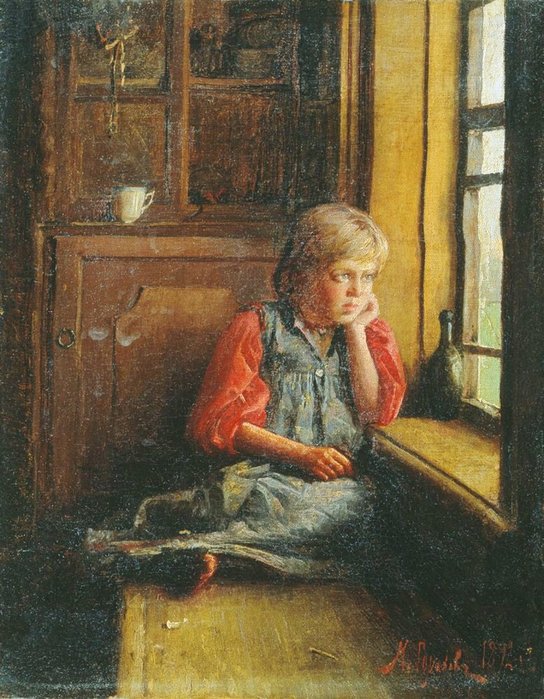
Identify the location of window. (491, 66), (484, 303).